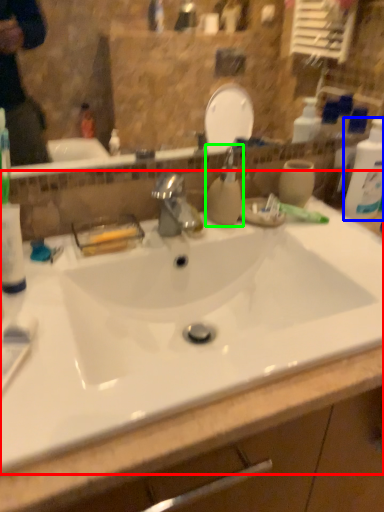
Question: Estimate the real-world distances between objects in this image. Which object is closer to sink (highlighted by a red box), cleaning product (highlighted by a blue box) or soap dispenser (highlighted by a green box)?

Choices:
 (A) cleaning product
 (B) soap dispenser

Answer: (B)